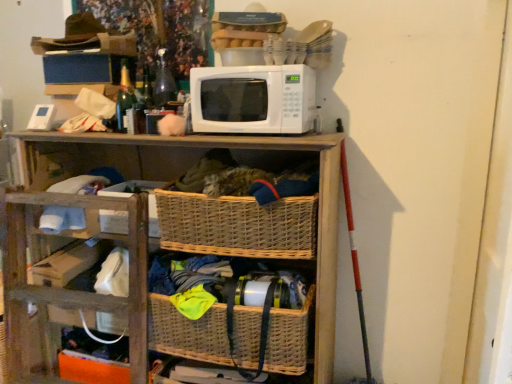
Identify the location of white cardboard box at center, the 2th storage box from the top. (141, 191).

Describe the element at coordinates (124, 94) in the screenshot. I see `green glass bottle at upper left` at that location.

This screenshot has height=384, width=512. Describe the element at coordinates (253, 99) in the screenshot. I see `white matte microwave at upper center` at that location.

Image resolution: width=512 pixels, height=384 pixels. In order to click on white matte microwave at upper center in this screenshot , I will do `click(253, 99)`.

Based on the photo, in order to face woven basket at center, should I rotate leftwards or rightwards?

Turn left by 1.222 degrees to look at woven basket at center.

At what (x,y) coordinates should I click in order to perform the action: click on woven wood shelf at center. Please return your answer as a coordinate pair (x, y). The image size is (512, 384). Looking at the image, I should click on pyautogui.click(x=147, y=243).

Find the location of `woven brown basket at center, which ranks as the 1th basket in top-to-bottom order`. woven brown basket at center, which ranks as the 1th basket in top-to-bottom order is located at coordinates (237, 225).

Is blue cardboard box at upper left, the first storage box when ordered from top to bottom, facing away from green glass bottle at upper left?

No, green glass bottle at upper left is not at the back of blue cardboard box at upper left, the first storage box when ordered from top to bottom.

Looking at this image, is blue cardboard box at upper left, the first storage box when ordered from top to bottom, directly adjacent to green glass bottle at upper left?

blue cardboard box at upper left, the first storage box when ordered from top to bottom, and green glass bottle at upper left are clearly separated.

This screenshot has height=384, width=512. What are the coordinates of `storage box that is the 2nd one when counting backward from the green glass bottle at upper left` in the screenshot? It's located at (77, 69).

Is woven wood shelf at center at the right side of white cardboard box at center, which ranks as the 1th storage box in bottom-to-top order?

Yes.

This screenshot has width=512, height=384. I want to click on storage box that is the 1st object above the woven wood shelf at center (from a real-world perspective), so click(x=141, y=191).

Between point (278, 357) and point (114, 222), which one is positioned in front?

The point (278, 357) is more forward.

Is woven wood shelf at center beside white cardboard box at center, the 2th storage box from the top?

They are not placed beside each other.

Based on the photo, considering the sizes of white matte microwave at upper center and woven wicker basket at lower center, which is the 1th basket in bottom-to-top order, in the image, is white matte microwave at upper center bigger or smaller than woven wicker basket at lower center, which is the 1th basket in bottom-to-top order,?

In the image, white matte microwave at upper center appears to be smaller than woven wicker basket at lower center, which is the 1th basket in bottom-to-top order.

Would you say white matte microwave at upper center is outside woven wicker basket at lower center, acting as the 2th basket starting from the top?

Yes, white matte microwave at upper center is not within woven wicker basket at lower center, acting as the 2th basket starting from the top.

In terms of height, does white matte microwave at upper center look taller or shorter compared to woven wicker basket at lower center, which is the 1th basket in bottom-to-top order?

Considering their sizes, white matte microwave at upper center has less height than woven wicker basket at lower center, which is the 1th basket in bottom-to-top order.

Where is `basket that is the 2nd object to the left of the white matte microwave at upper center, starting at the anchor`? The width and height of the screenshot is (512, 384). basket that is the 2nd object to the left of the white matte microwave at upper center, starting at the anchor is located at coordinates (205, 333).

Which point is more forward, [261,79] or [215,161]?

The point [261,79] is in front.

Where is `material in front of the white matte microwave at upper center`? The image size is (512, 384). material in front of the white matte microwave at upper center is located at coordinates (249, 179).

Would you say woven basket at center is part of white matte microwave at upper center's contents?

No, woven basket at center is not inside white matte microwave at upper center.

In terms of width, does white matte microwave at upper center look wider or thinner when compared to woven basket at center?

Considering their sizes, white matte microwave at upper center looks slimmer than woven basket at center.

Does point (91, 64) come farther from viewer compared to point (154, 207)?

Yes, point (91, 64) is farther from viewer.

Is white cardboard box at center, which ranks as the 1th storage box in bottom-to-top order, surrounded by blue cardboard box at upper left, which appears as the second storage box when ordered from the bottom?

No, white cardboard box at center, which ranks as the 1th storage box in bottom-to-top order, is located outside of blue cardboard box at upper left, which appears as the second storage box when ordered from the bottom.

Measure the distance from blue cardboard box at upper left, the first storage box when ordered from top to bottom, to white cardboard box at center, which ranks as the 1th storage box in bottom-to-top order.

blue cardboard box at upper left, the first storage box when ordered from top to bottom, is 21.89 inches from white cardboard box at center, which ranks as the 1th storage box in bottom-to-top order.

This screenshot has height=384, width=512. I want to click on microwave oven that appears above the woven wood shelf at center (from the image's perspective), so click(253, 99).

From the image's perspective, is woven wood shelf at center beneath white matte microwave at upper center?

Yes, from the image's perspective, woven wood shelf at center is beneath white matte microwave at upper center.

Between woven wood shelf at center and white matte microwave at upper center, which one has smaller width?

Thinner between the two is white matte microwave at upper center.

Is point (185, 337) closer to camera compared to point (68, 158)?

Yes, point (185, 337) is in front of point (68, 158).

Which is more to the left, woven wicker basket at lower center, acting as the 2th basket starting from the top, or woven wood shelf at center?

woven wood shelf at center.

From a real-world perspective, does woven wicker basket at lower center, acting as the 2th basket starting from the top, stand above woven wood shelf at center?

Incorrect, from a real-world perspective, woven wicker basket at lower center, acting as the 2th basket starting from the top, is lower than woven wood shelf at center.

Is woven wicker basket at lower center, acting as the 2th basket starting from the top, bigger or smaller than woven wood shelf at center?

Considering their sizes, woven wicker basket at lower center, acting as the 2th basket starting from the top, takes up less space than woven wood shelf at center.

The image size is (512, 384). I want to click on bottle on the right of blue cardboard box at upper left, which appears as the second storage box when ordered from the bottom, so click(x=124, y=94).

Where is `shelf that is under the white cardboard box at center, which ranks as the 1th storage box in bottom-to-top order (from a real-world perspective)`? The width and height of the screenshot is (512, 384). shelf that is under the white cardboard box at center, which ranks as the 1th storage box in bottom-to-top order (from a real-world perspective) is located at coordinates (147, 243).

Looking at the image, which one is located further to green glass bottle at upper left, white matte microwave at upper center or white cardboard box at center, the 2th storage box from the top?

white matte microwave at upper center is positioned further to the anchor green glass bottle at upper left.

Considering their positions, is woven wood shelf at center positioned further to white cardboard box at center, which ranks as the 1th storage box in bottom-to-top order, than white matte microwave at upper center?

white matte microwave at upper center is positioned further to the anchor white cardboard box at center, which ranks as the 1th storage box in bottom-to-top order.

Based on their spatial positions, is green glass bottle at upper left or blue cardboard box at upper left, the first storage box when ordered from top to bottom, further from woven wood shelf at center?

Among the two, blue cardboard box at upper left, the first storage box when ordered from top to bottom, is located further to woven wood shelf at center.

From the image, which object appears to be nearer to woven brown basket at center, which is the 2th basket from bottom to top, green glass bottle at upper left or woven wicker basket at lower center, acting as the 2th basket starting from the top?

woven wicker basket at lower center, acting as the 2th basket starting from the top, is closer to woven brown basket at center, which is the 2th basket from bottom to top.

Which object lies nearer to the anchor point white cardboard box at center, the 2th storage box from the top, woven brown basket at center, which is the 2th basket from bottom to top, or white matte microwave at upper center?

woven brown basket at center, which is the 2th basket from bottom to top, lies closer to white cardboard box at center, the 2th storage box from the top, than the other object.

From the image, which object appears to be nearer to woven basket at center, woven wicker basket at lower center, acting as the 2th basket starting from the top, or woven wood shelf at center?

woven wood shelf at center is positioned closer to the anchor woven basket at center.

Looking at the image, which one is located closer to woven wicker basket at lower center, acting as the 2th basket starting from the top, green glass bottle at upper left or woven brown basket at center, which is the 2th basket from bottom to top?

woven brown basket at center, which is the 2th basket from bottom to top.

Estimate the real-world distances between objects in this image. Which object is closer to woven wood shelf at center, woven brown basket at center, which is the 2th basket from bottom to top, or woven wicker basket at lower center, which is the 1th basket in bottom-to-top order?

woven wicker basket at lower center, which is the 1th basket in bottom-to-top order, is positioned closer to the anchor woven wood shelf at center.

Locate an element on the screen. Image resolution: width=512 pixels, height=384 pixels. basket between blue cardboard box at upper left, which appears as the second storage box when ordered from the bottom, and woven wicker basket at lower center, which is the 1th basket in bottom-to-top order, from top to bottom is located at coordinates (237, 225).

Locate an element on the screen. Image resolution: width=512 pixels, height=384 pixels. storage box between green glass bottle at upper left and woven brown basket at center, which is the 2th basket from bottom to top, vertically is located at coordinates (141, 191).

Identify the location of storage box that lies between woven basket at center and woven wood shelf at center from top to bottom. This screenshot has height=384, width=512. (141, 191).

I want to click on basket between green glass bottle at upper left and woven wicker basket at lower center, which is the 1th basket in bottom-to-top order, in the up-down direction, so click(237, 225).